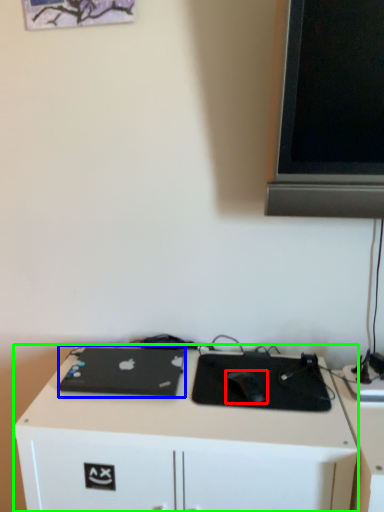
Question: Which object is positioned closest to mouse (highlighted by a red box)? Select from laptop (highlighted by a blue box) and desk (highlighted by a green box).

Choices:
 (A) laptop
 (B) desk

Answer: (B)